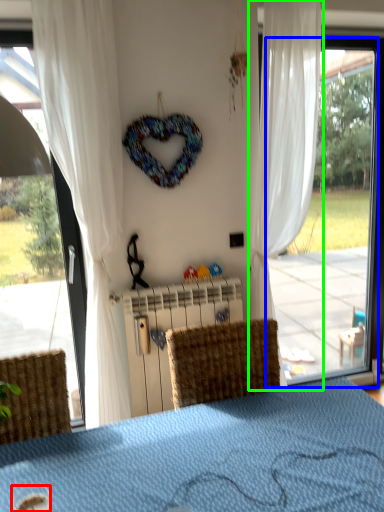
Question: Which object is positioned closest to beverage (highlighted by a red box)? Select from window (highlighted by a blue box) and curtain (highlighted by a green box).

Choices:
 (A) window
 (B) curtain

Answer: (A)